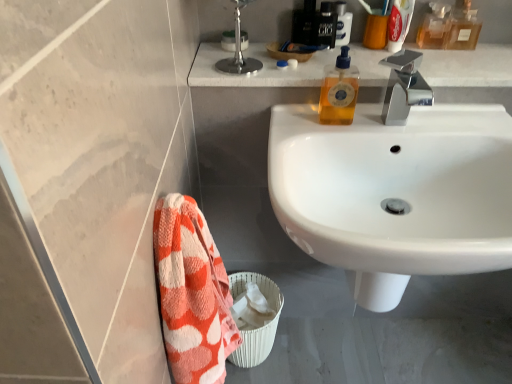
At what (x,y) coordinates should I click in order to perform the action: click on free space to the right of polished chrome faucet at upper right. Please return your answer as a coordinate pair (x, y). The width and height of the screenshot is (512, 384). Looking at the image, I should click on (308, 64).